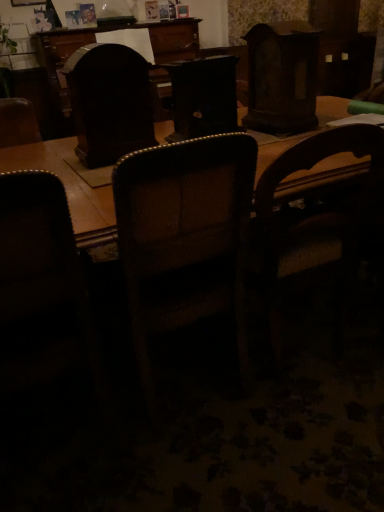
Question: Which direction should I rotate to look at brown leather chair at center, the 2th chair in the left-to-right sequence, — up or down?

Choices:
 (A) down
 (B) up

Answer: (A)

Question: Does dark wood swivel chair at center have a larger size compared to wooden chair at center, which is counted as the 3th chair, starting from the left?

Choices:
 (A) no
 (B) yes

Answer: (A)

Question: Can you confirm if dark wood swivel chair at center is smaller than wooden chair at center, which appears as the 1th chair when viewed from the right?

Choices:
 (A) no
 (B) yes

Answer: (B)

Question: Does dark wood swivel chair at center have a greater width compared to wooden chair at center, which appears as the 1th chair when viewed from the right?

Choices:
 (A) no
 (B) yes

Answer: (A)

Question: Can you confirm if dark wood swivel chair at center is thinner than wooden chair at center, which appears as the 1th chair when viewed from the right?

Choices:
 (A) no
 (B) yes

Answer: (B)

Question: From a real-world perspective, is dark wood swivel chair at center over wooden chair at center, which appears as the 1th chair when viewed from the right?

Choices:
 (A) no
 (B) yes

Answer: (B)

Question: From a real-world perspective, is dark wood swivel chair at center positioned under wooden chair at center, which is counted as the 3th chair, starting from the left, based on gravity?

Choices:
 (A) yes
 (B) no

Answer: (B)

Question: Does dark wood swivel chair at center appear on the right side of dark brown leather chair at left, the first chair when ordered from left to right?

Choices:
 (A) no
 (B) yes

Answer: (B)

Question: From a real-world perspective, is dark wood swivel chair at center beneath dark brown leather chair at left, the third chair from the right?

Choices:
 (A) yes
 (B) no

Answer: (B)

Question: Is dark wood swivel chair at center further to the viewer compared to dark brown leather chair at left, the third chair from the right?

Choices:
 (A) no
 (B) yes

Answer: (B)

Question: Are dark wood swivel chair at center and dark brown leather chair at left, the first chair when ordered from left to right, beside each other?

Choices:
 (A) yes
 (B) no

Answer: (B)

Question: From the image's perspective, is dark wood swivel chair at center on dark brown leather chair at left, the third chair from the right?

Choices:
 (A) yes
 (B) no

Answer: (A)

Question: Can you confirm if dark wood swivel chair at center is positioned to the left of dark brown leather chair at left, the third chair from the right?

Choices:
 (A) yes
 (B) no

Answer: (B)

Question: From the image's perspective, would you say dark brown leather chair at left, the first chair when ordered from left to right, is positioned over brown leather chair at center, the 2th chair in the left-to-right sequence?

Choices:
 (A) no
 (B) yes

Answer: (A)